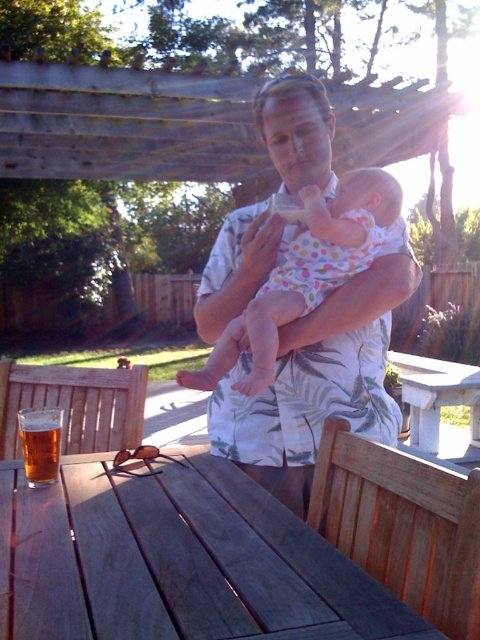
Question: Is wooden table at center to the right of white polka dot fabric baby at center from the viewer's perspective?

Choices:
 (A) no
 (B) yes

Answer: (A)

Question: Can you confirm if white floral shirt at center is thinner than white polka dot fabric baby at center?

Choices:
 (A) yes
 (B) no

Answer: (A)

Question: Which object is farther from the camera taking this photo?

Choices:
 (A) white stone picnic table at center
 (B) white polka dot fabric baby at center
 (C) golden amber liquid at table left
 (D) wooden table at center

Answer: (A)

Question: Is wooden table at center closer to the viewer compared to white polka dot fabric baby at center?

Choices:
 (A) yes
 (B) no

Answer: (A)

Question: Among these objects, which one is farthest from the camera?

Choices:
 (A) wooden table at center
 (B) white polka dot fabric baby at center
 (C) golden amber liquid at table left

Answer: (B)

Question: Which of these objects is positioned farthest from the golden amber liquid at table left?

Choices:
 (A) white stone picnic table at center
 (B) wooden table at center

Answer: (A)